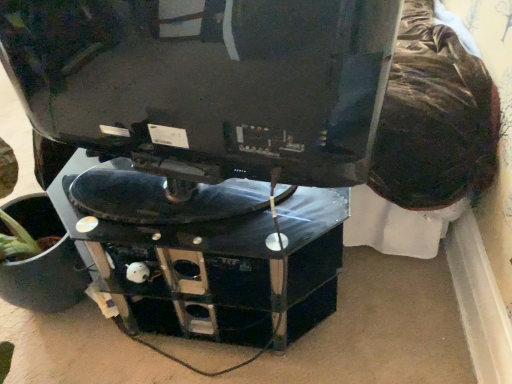
Describe the element at coordinates (207, 82) in the screenshot. I see `matte black monitor at upper center` at that location.

Locate an element on the screen. The image size is (512, 384). matte black monitor at upper center is located at coordinates (207, 82).

The image size is (512, 384). I want to click on black glossy computer desk at center, so click(x=208, y=260).

Measure the distance between point [223,220] and camera.

The distance of point [223,220] from camera is 1.04 meters.

What do you see at coordinates (208, 260) in the screenshot? This screenshot has width=512, height=384. I see `black glossy computer desk at center` at bounding box center [208, 260].

Identify the location of matte black monitor at upper center. The image size is (512, 384). (207, 82).

Which is more to the left, black glossy computer desk at center or matte black monitor at upper center?

Positioned to the left is matte black monitor at upper center.

Is black glossy computer desk at center further to camera compared to matte black monitor at upper center?

Yes.

Is point (98, 252) closer or farther from the camera than point (240, 82)?

Point (98, 252) is farther from the camera than point (240, 82).

From the image's perspective, does black glossy computer desk at center appear lower than matte black monitor at upper center?

Correct, black glossy computer desk at center appears lower than matte black monitor at upper center in the image.

From a real-world perspective, which is physically below, black glossy computer desk at center or matte black monitor at upper center?

In real-world perspective, black glossy computer desk at center is lower.

Which object is wider, black glossy computer desk at center or matte black monitor at upper center?

Wider between the two is black glossy computer desk at center.

Can you confirm if black glossy computer desk at center is taller than matte black monitor at upper center?

No.

Consider the image. Is black glossy computer desk at center smaller than matte black monitor at upper center?

No, black glossy computer desk at center is not smaller than matte black monitor at upper center.

Can we say black glossy computer desk at center lies outside matte black monitor at upper center?

Indeed, black glossy computer desk at center is completely outside matte black monitor at upper center.

Is black glossy computer desk at center with matte black monitor at upper center?

No.

Is black glossy computer desk at center facing away from matte black monitor at upper center?

No.

Looking at this image, can you tell me how much black glossy computer desk at center and matte black monitor at upper center differ in facing direction?

170 degrees separate the facing orientations of black glossy computer desk at center and matte black monitor at upper center.

This screenshot has height=384, width=512. I want to click on computer desk below the matte black monitor at upper center (from a real-world perspective), so click(208, 260).

Considering the relative positions of matte black monitor at upper center and black glossy computer desk at center in the image provided, is matte black monitor at upper center to the right of black glossy computer desk at center from the viewer's perspective?

Incorrect, matte black monitor at upper center is not on the right side of black glossy computer desk at center.

Considering the positions of objects matte black monitor at upper center and black glossy computer desk at center in the image provided, who is in front, matte black monitor at upper center or black glossy computer desk at center?

matte black monitor at upper center is closer to the camera.

Does point (233, 144) come closer to viewer compared to point (62, 184)?

Yes, it is in front of point (62, 184).

From the image's perspective, is matte black monitor at upper center under black glossy computer desk at center?

Incorrect, from the image's perspective, matte black monitor at upper center is higher than black glossy computer desk at center.

Consider the image. From a real-world perspective, is matte black monitor at upper center physically located above or below black glossy computer desk at center?

matte black monitor at upper center is situated higher than black glossy computer desk at center in the real world.

Does matte black monitor at upper center have a lesser width compared to black glossy computer desk at center?

Correct, the width of matte black monitor at upper center is less than that of black glossy computer desk at center.

Does matte black monitor at upper center have a lesser height compared to black glossy computer desk at center?

No.

Which of these two, matte black monitor at upper center or black glossy computer desk at center, is smaller?

With smaller size is matte black monitor at upper center.

Is matte black monitor at upper center completely or partially outside of black glossy computer desk at center?

Yes, matte black monitor at upper center is not within black glossy computer desk at center.

Would you consider matte black monitor at upper center to be distant from black glossy computer desk at center?

No, there isn't a large distance between matte black monitor at upper center and black glossy computer desk at center.

Is matte black monitor at upper center oriented towards black glossy computer desk at center?

No.

How different are the orientations of matte black monitor at upper center and black glossy computer desk at center in degrees?

170 degrees.

Locate an element on the screen. computer monitor in front of the black glossy computer desk at center is located at coordinates (207, 82).

Find the location of `computer monitor that is in front of the black glossy computer desk at center`. computer monitor that is in front of the black glossy computer desk at center is located at coordinates (207, 82).

Where is `computer monitor that appears above the black glossy computer desk at center (from a real-world perspective)`? computer monitor that appears above the black glossy computer desk at center (from a real-world perspective) is located at coordinates (207, 82).